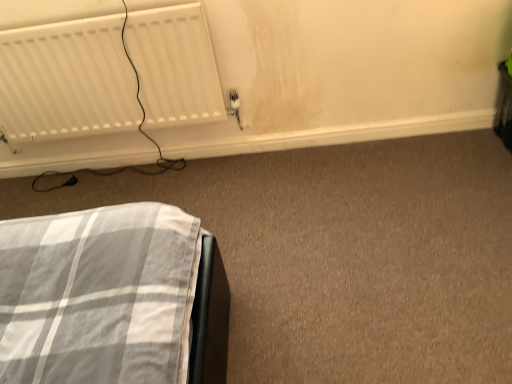
What do you see at coordinates (66, 81) in the screenshot? I see `white matte radiator at upper left` at bounding box center [66, 81].

This screenshot has width=512, height=384. I want to click on white matte radiator at upper left, so click(x=66, y=81).

Locate an element on the screen. The width and height of the screenshot is (512, 384). white matte radiator at upper left is located at coordinates (66, 81).